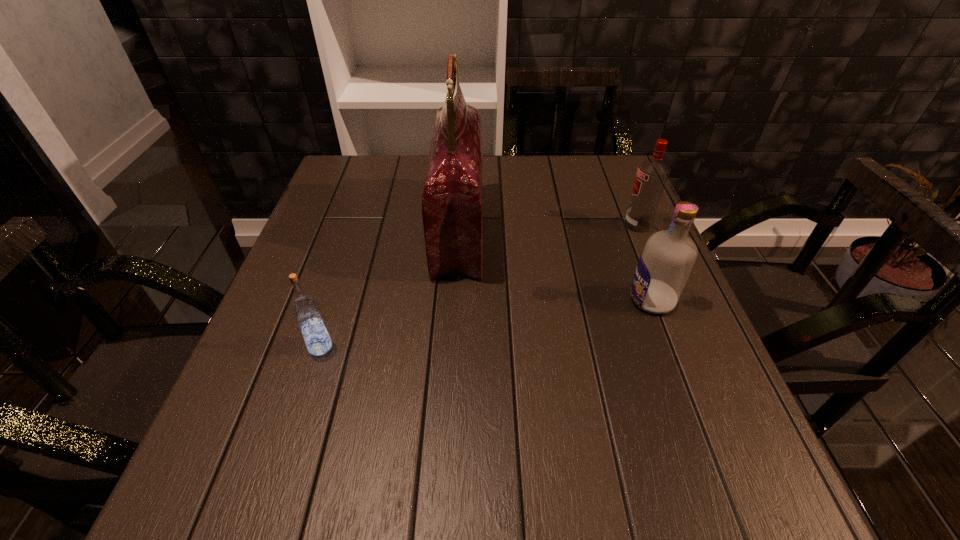
In the image, there is a desktop. Find the location of `free space at the far left corner`. free space at the far left corner is located at coordinates (343, 191).

In the image, there is a desktop. In order to click on vacant space at the far right corner in this screenshot , I will do `click(588, 167)`.

In order to click on free area in between the nearest object and the tallest object in this screenshot , I will do click(x=390, y=288).

Where is `empty location between the handbag and the second nearest object`? The width and height of the screenshot is (960, 540). empty location between the handbag and the second nearest object is located at coordinates (555, 265).

Where is `free spot between the tallest object and the leftmost object`? Image resolution: width=960 pixels, height=540 pixels. free spot between the tallest object and the leftmost object is located at coordinates (390, 288).

I want to click on empty location between the farthest vodka and the third object from right to left, so click(x=548, y=227).

What are the coordinates of `vacant space that's between the tallest object and the nearest object` in the screenshot? It's located at (390, 288).

What are the coordinates of `empty location between the leftmost vodka and the third farthest object` in the screenshot? It's located at [486, 323].

Where is `free point between the farthest vodka and the handbag`? This screenshot has width=960, height=540. free point between the farthest vodka and the handbag is located at coordinates (x=548, y=227).

The height and width of the screenshot is (540, 960). In order to click on the third closest object to the second nearest vodka in this screenshot , I will do `click(305, 309)`.